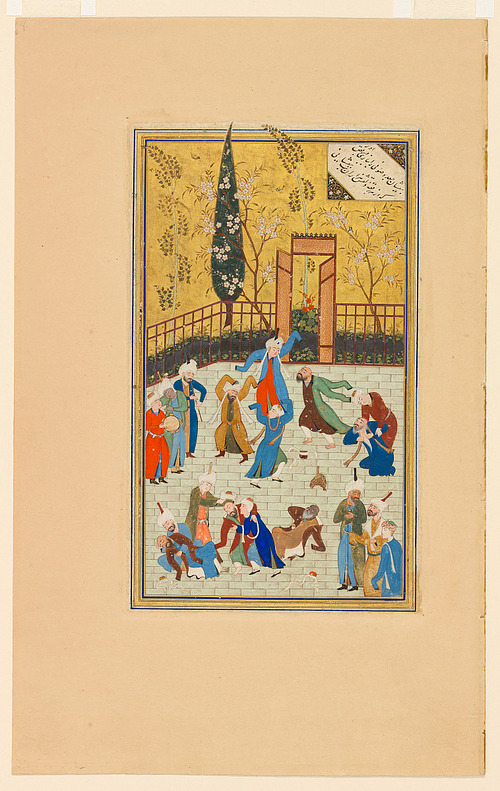
Locate an element on the screen. painting is located at coordinates (246, 278).